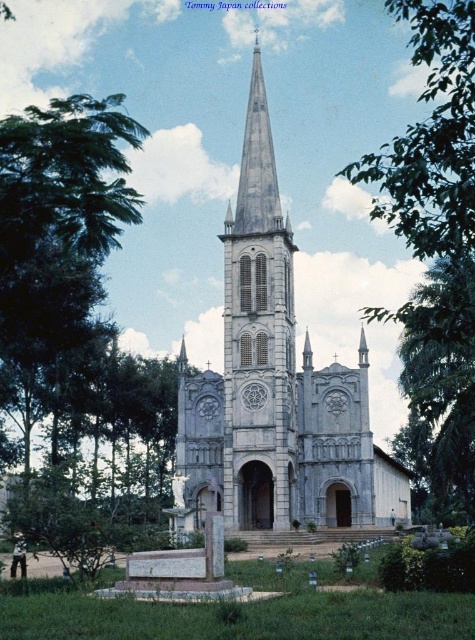
Question: Can you confirm if white stone tower at center is positioned below green leafy tree at upper right?

Choices:
 (A) yes
 (B) no

Answer: (A)

Question: Does white stone church at center appear on the left side of green leafy tree at right?

Choices:
 (A) no
 (B) yes

Answer: (B)

Question: Which point appears farthest from the camera in this image?

Choices:
 (A) (399, 310)
 (B) (263, 211)
 (C) (378, 509)

Answer: (B)

Question: Is white stone tower at center above green leafy tree at right?

Choices:
 (A) yes
 (B) no

Answer: (A)

Question: Which of the following is the closest to the observer?

Choices:
 (A) green leafy tree at right
 (B) green leafy tree at upper right
 (C) white stone tower at center

Answer: (B)

Question: Which point is closer to the camera taking this photo?

Choices:
 (A) (450, 163)
 (B) (179, 458)

Answer: (A)